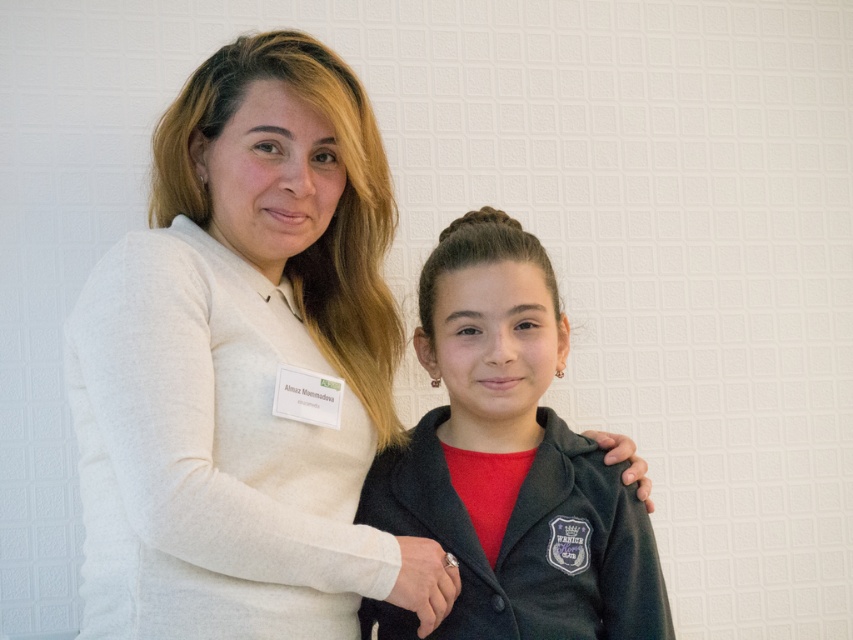
You are a photographer standing at a certain distance from the white soft sweater at upper left. You want to ensure that the sweater is in focus while capturing the scene. If your camera has a minimum focusing distance of 40 inches, will you need to move closer or farther away to achieve this?

The distance between the white soft sweater at upper left and the camera is 39.03 inches, which is less than the camera minimum focusing distance of 40 inches. Therefore, you need to move farther away to achieve focus.

You are trying to hang a picture frame on the wall between the white soft sweater at upper left and the matte black jacket at center. The frame is 1.2 meters tall. Can you fit it vertically between them?

The white soft sweater at upper left is taller than the matte black jacket at center. Therefore, the vertical space between them may be sufficient to accommodate the 1.2 meter tall frame, but exact dimensions are not provided.